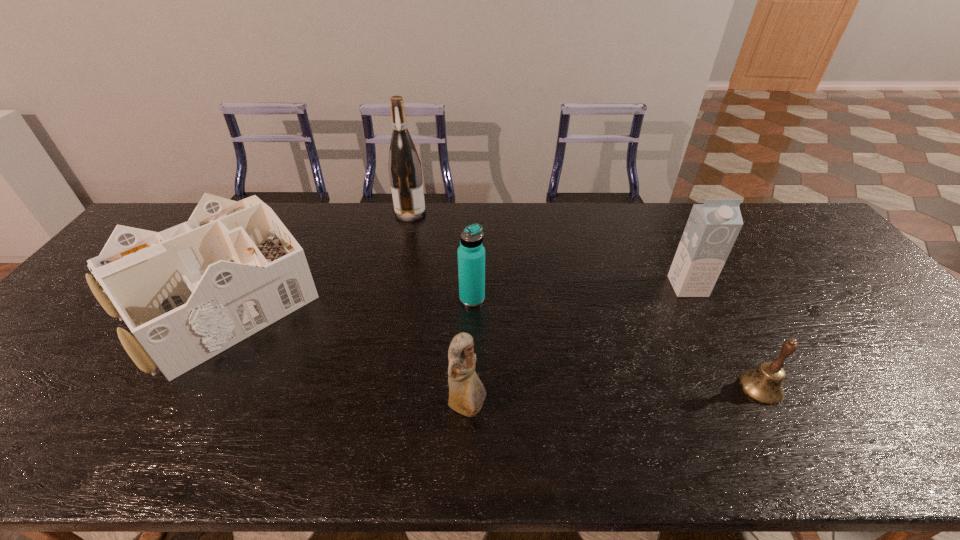
Locate an element on the screen. the closest object relative to the water bottle is located at coordinates (467, 393).

Find the location of a particular element. This screenshot has height=540, width=960. object identified as the third closest to the wine bottle is located at coordinates (467, 393).

Identify the location of vacant area that satisfies the following two spatial constraints: 1. on the front side of the water bottle; 2. on the front-facing side of the figurine. (470, 408).

Locate an element on the screen. This screenshot has width=960, height=540. vacant region that satisfies the following two spatial constraints: 1. on the front side of the shortest object; 2. on the right side of the water bottle is located at coordinates point(470,388).

What are the coordinates of `vacant space that satisfies the following two spatial constraints: 1. on the back side of the dollhouse; 2. on the right side of the water bottle` in the screenshot? It's located at (226, 299).

This screenshot has width=960, height=540. Identify the location of vacant point that satisfies the following two spatial constraints: 1. on the front side of the wine bottle; 2. on the left side of the bell. (373, 388).